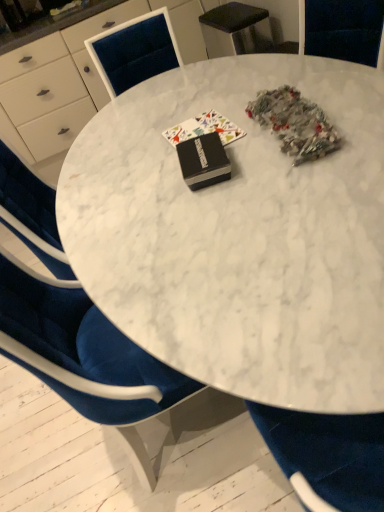
The image size is (384, 512). Describe the element at coordinates (204, 129) in the screenshot. I see `black matte book at center, which appears as the first book when viewed from the back` at that location.

Where is `white marble table at center`? This screenshot has width=384, height=512. white marble table at center is located at coordinates (55, 90).

From a real-world perspective, is black matte book at center, which ranks as the second book in back-to-front order, physically above white marble table at center?

Indeed, from a real-world perspective, black matte book at center, which ranks as the second book in back-to-front order, stands above white marble table at center.

Is black matte book at center, placed as the 1th book when sorted from front to back, thinner than white marble table at center?

Indeed, black matte book at center, placed as the 1th book when sorted from front to back, has a lesser width compared to white marble table at center.

Could you tell me if black matte book at center, which ranks as the second book in back-to-front order, is turned towards white marble table at center?

No.

Where is `table in front of the black matte book at center, which is counted as the 2th book, starting from the front`? table in front of the black matte book at center, which is counted as the 2th book, starting from the front is located at coordinates (240, 234).

From a real-world perspective, between white marble table at center and black matte book at center, which appears as the first book when viewed from the back, who is vertically lower?

white marble table at center is physically lower.

Is white marble table at center looking in the opposite direction of black matte book at center, which appears as the first book when viewed from the back?

No.

Considering the relative positions of white marble table at center and black matte book at center, which is counted as the 2th book, starting from the front, in the image provided, is white marble table at center to the right of black matte book at center, which is counted as the 2th book, starting from the front, from the viewer's perspective?

Yes, white marble table at center is to the right of black matte book at center, which is counted as the 2th book, starting from the front.

Is white marble table at center inside or outside of white marble table at center?

white marble table at center cannot be found inside white marble table at center.

Is white marble table at center positioned with its back to white marble table at center?

That's not correct — white marble table at center is not looking away from white marble table at center.

From a real-world perspective, is white marble table at center under white marble table at center?

No, from a real-world perspective, white marble table at center is not below white marble table at center.

Based on their positions, is white marble table at center located to the left or right of white marble table at center?

Clearly, white marble table at center is on the left of white marble table at center in the image.

Is white marble table at center completely or partially outside of black matte book at center, which ranks as the second book in back-to-front order?

Yes, white marble table at center is not within black matte book at center, which ranks as the second book in back-to-front order.

Which is closer to the camera, (103,93) or (207,179)?

Point (103,93) is farther from the camera than point (207,179).

Is white marble table at center far away from black matte book at center, which ranks as the second book in back-to-front order?

Yes, white marble table at center and black matte book at center, which ranks as the second book in back-to-front order, are quite far apart.

From the image's perspective, is white marble table at center beneath black matte book at center, which ranks as the second book in back-to-front order?

No, from the image's perspective, white marble table at center is not below black matte book at center, which ranks as the second book in back-to-front order.

Considering the sizes of black matte book at center, which ranks as the second book in back-to-front order, and white marble table at center in the image, is black matte book at center, which ranks as the second book in back-to-front order, wider or thinner than white marble table at center?

Considering their sizes, black matte book at center, which ranks as the second book in back-to-front order, looks slimmer than white marble table at center.

Is point (187, 143) farther from viewer compared to point (157, 213)?

Yes, it is.

Where is `the 1st book behind when counting from the white marble table at center`? the 1st book behind when counting from the white marble table at center is located at coordinates (203, 161).

Is black matte book at center, placed as the 1th book when sorted from front to back, located outside white marble table at center?

Yes, black matte book at center, placed as the 1th book when sorted from front to back, is not within white marble table at center.

Is black matte book at center, which is counted as the 2th book, starting from the front, behind black matte book at center, placed as the 1th book when sorted from front to back?

Yes, it is behind black matte book at center, placed as the 1th book when sorted from front to back.

Considering the relative sizes of black matte book at center, which is counted as the 2th book, starting from the front, and black matte book at center, placed as the 1th book when sorted from front to back, in the image provided, is black matte book at center, which is counted as the 2th book, starting from the front, bigger than black matte book at center, placed as the 1th book when sorted from front to back,?

No, black matte book at center, which is counted as the 2th book, starting from the front, is not bigger than black matte book at center, placed as the 1th book when sorted from front to back.

From the image's perspective, would you say black matte book at center, which appears as the first book when viewed from the back, is positioned over black matte book at center, placed as the 1th book when sorted from front to back?

Correct, black matte book at center, which appears as the first book when viewed from the back, appears higher than black matte book at center, placed as the 1th book when sorted from front to back, in the image.

Is point (238, 136) behind point (219, 176)?

Yes, it is.

Between white marble table at center and white marble table at center, which one has larger width?

white marble table at center is wider.

Considering the positions of points (372, 279) and (26, 100), is point (372, 279) closer to camera compared to point (26, 100)?

Yes, point (372, 279) is in front of point (26, 100).

From the image's perspective, which one is positioned higher, white marble table at center or white marble table at center?

white marble table at center is shown above in the image.

From a real-world perspective, is white marble table at center on white marble table at center?

No.

At what (x,y) coordinates should I click in order to perform the action: click on book that is the 2nd one when counting downward from the white marble table at center (from the image's perspective). Please return your answer as a coordinate pair (x, y). Looking at the image, I should click on (203, 161).

Where is `table lying on the right of black matte book at center, which appears as the first book when viewed from the back`? table lying on the right of black matte book at center, which appears as the first book when viewed from the back is located at coordinates (240, 234).

Looking at the image, which one is located further to white marble table at center, white marble table at center or black matte book at center, which ranks as the second book in back-to-front order?

white marble table at center is positioned further to the anchor white marble table at center.

Based on their spatial positions, is black matte book at center, which is counted as the 2th book, starting from the front, or black matte book at center, which ranks as the second book in back-to-front order, closer to white marble table at center?

The object closer to white marble table at center is black matte book at center, which ranks as the second book in back-to-front order.

Considering their positions, is white marble table at center positioned closer to black matte book at center, which is counted as the 2th book, starting from the front, than black matte book at center, placed as the 1th book when sorted from front to back?

Among the two, black matte book at center, placed as the 1th book when sorted from front to back, is located nearer to black matte book at center, which is counted as the 2th book, starting from the front.

Which object lies further to the anchor point white marble table at center, black matte book at center, which ranks as the second book in back-to-front order, or black matte book at center, which is counted as the 2th book, starting from the front?

black matte book at center, which ranks as the second book in back-to-front order.

Estimate the real-world distances between objects in this image. Which object is further from white marble table at center, white marble table at center or black matte book at center, which ranks as the second book in back-to-front order?

black matte book at center, which ranks as the second book in back-to-front order, is further to white marble table at center.

Estimate the real-world distances between objects in this image. Which object is further from black matte book at center, which is counted as the 2th book, starting from the front, white marble table at center or white marble table at center?

white marble table at center is positioned further to the anchor black matte book at center, which is counted as the 2th book, starting from the front.

Looking at the image, which one is located further to black matte book at center, which ranks as the second book in back-to-front order, white marble table at center or white marble table at center?

Based on the image, white marble table at center appears to be further to black matte book at center, which ranks as the second book in back-to-front order.

When comparing their distances from white marble table at center, does black matte book at center, which is counted as the 2th book, starting from the front, or white marble table at center seem further?

The object further to white marble table at center is white marble table at center.

The height and width of the screenshot is (512, 384). I want to click on book between white marble table at center and black matte book at center, which is counted as the 2th book, starting from the front, in the front-back direction, so tap(203, 161).

Where is `book between black matte book at center, which ranks as the second book in back-to-front order, and white marble table at center, along the z-axis`? book between black matte book at center, which ranks as the second book in back-to-front order, and white marble table at center, along the z-axis is located at coordinates (204, 129).